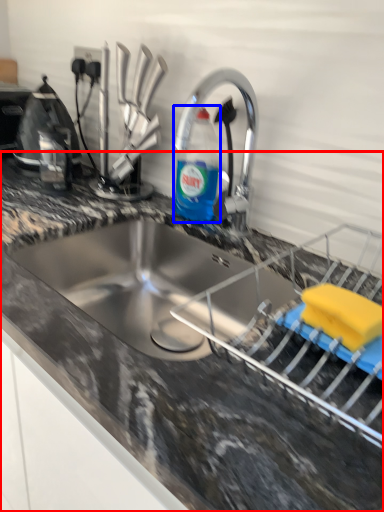
Question: Which point is closer to the camera, countertop (highlighted by a red box) or bottle (highlighted by a blue box)?

Choices:
 (A) countertop
 (B) bottle

Answer: (A)